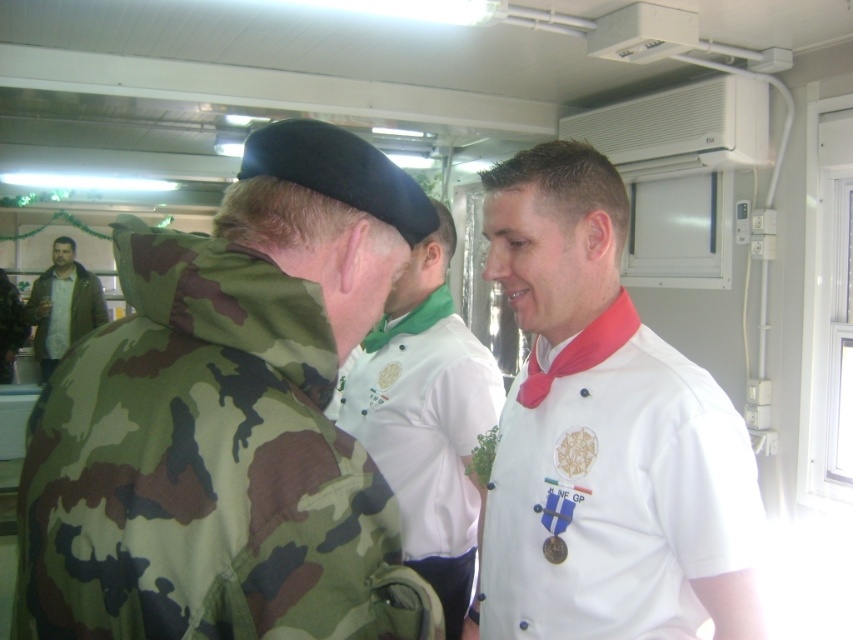
Does camo fabric jacket at left have a smaller size compared to white matte chef's coat at center?

Yes, camo fabric jacket at left is smaller than white matte chef's coat at center.

Between camo fabric jacket at left and white matte chef's coat at center, which one is positioned lower?

white matte chef's coat at center is lower down.

Who is more distant from viewer, [329,163] or [643,612]?

Positioned behind is point [643,612].

In order to click on camo fabric jacket at left in this screenshot , I will do `click(228, 420)`.

Describe the element at coordinates (228, 420) in the screenshot. I see `camo fabric jacket at left` at that location.

Which is more to the right, camo fabric jacket at left or brown leather jacket at left?

Positioned to the right is camo fabric jacket at left.

You are a GUI agent. You are given a task and a screenshot of the screen. Output one action in this format:
    pyautogui.click(x=<x>, y=<y>)
    Task: Click on the camo fabric jacket at left
    The width and height of the screenshot is (853, 640).
    Given the screenshot: What is the action you would take?
    pyautogui.click(x=228, y=420)

Locate an element on the screen. camo fabric jacket at left is located at coordinates (228, 420).

Can you confirm if brown leather jacket at left is shorter than camouflage fabric jacket at left?

In fact, brown leather jacket at left may be taller than camouflage fabric jacket at left.

Is brown leather jacket at left above camouflage fabric jacket at left?

Indeed, brown leather jacket at left is positioned over camouflage fabric jacket at left.

Which is in front, point (86, 324) or point (10, 305)?

Point (86, 324)

This screenshot has height=640, width=853. Identify the location of brown leather jacket at left. (62, 305).